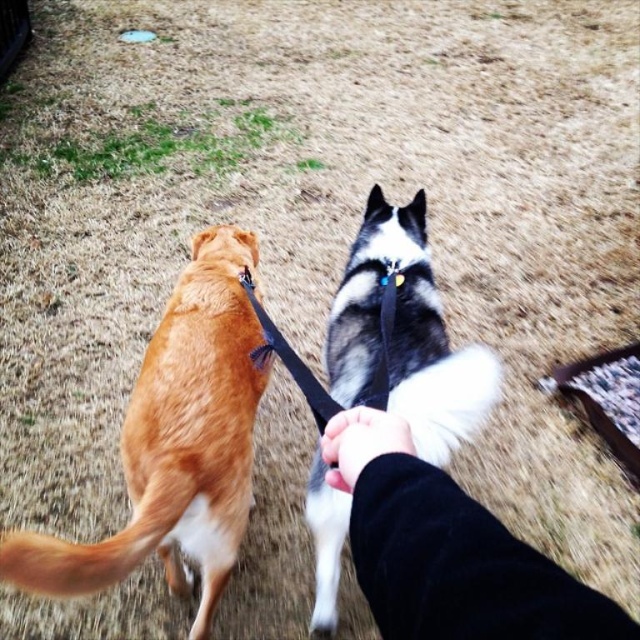
Looking at this image, who is taller, black fleece hand at center or black and white fur at center?

black and white fur at center

Is black fleece hand at center closer to the viewer compared to black and white fur at center?

Yes, it is in front of black and white fur at center.

Locate an element on the screen. black fleece hand at center is located at coordinates (448, 550).

Is the position of golden fur dog at left more distant than that of black fleece hand at center?

That is True.

Is golden fur dog at left closer to the viewer compared to black fleece hand at center?

No.

Is point (262, 364) farther from camera compared to point (497, 564)?

Yes, it is behind point (497, 564).

Locate an element on the screen. golden fur dog at left is located at coordinates (176, 444).

Which is below, golden fur dog at left or black and white fur at center?

black and white fur at center

What do you see at coordinates (176, 444) in the screenshot?
I see `golden fur dog at left` at bounding box center [176, 444].

I want to click on golden fur dog at left, so click(176, 444).